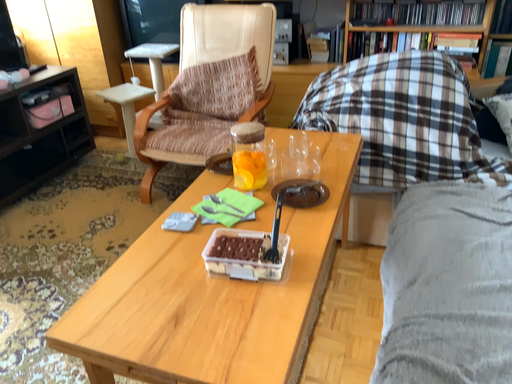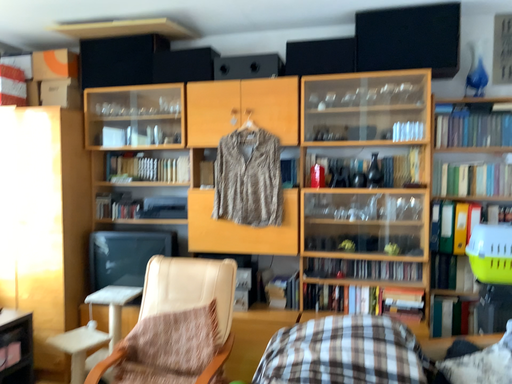
Question: How did the camera likely rotate when shooting the video?

Choices:
 (A) rotated downward
 (B) rotated upward

Answer: (B)